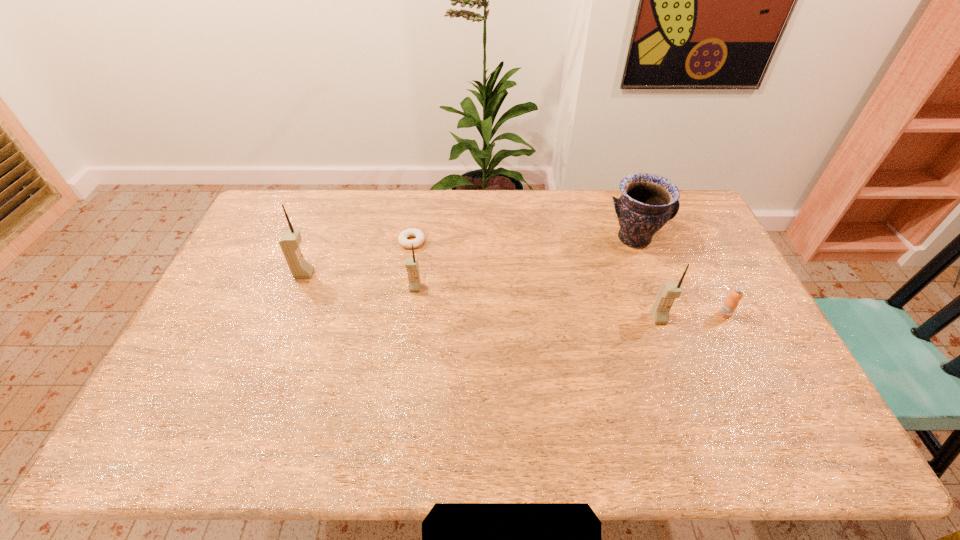
Locate an element on the screen. Image resolution: width=960 pixels, height=540 pixels. free space for an extra cellular_telephone to achieve even spacing is located at coordinates (533, 302).